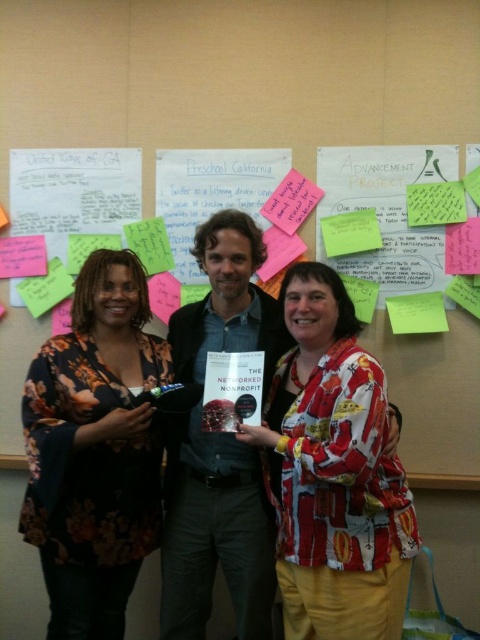
Question: Among these objects, which one is nearest to the camera?

Choices:
 (A) floral print blouse at left
 (B) denim shirt at center

Answer: (A)

Question: Observing the image, what is the correct spatial positioning of printed fabric shirt at center in reference to denim shirt at center?

Choices:
 (A) right
 (B) left

Answer: (A)

Question: Can you confirm if floral print blouse at left is smaller than denim shirt at center?

Choices:
 (A) yes
 (B) no

Answer: (B)

Question: From the image, what is the correct spatial relationship of denim shirt at center in relation to white paper notes at upper center?

Choices:
 (A) above
 (B) below

Answer: (A)

Question: Which of these objects is positioned farthest from the denim shirt at center?

Choices:
 (A) floral print blouse at left
 (B) printed fabric shirt at center
 (C) white paper notes at upper center

Answer: (C)

Question: Which of these objects is positioned farthest from the denim shirt at center?

Choices:
 (A) printed fabric shirt at center
 (B) floral print blouse at left
 (C) white paper notes at upper center

Answer: (C)